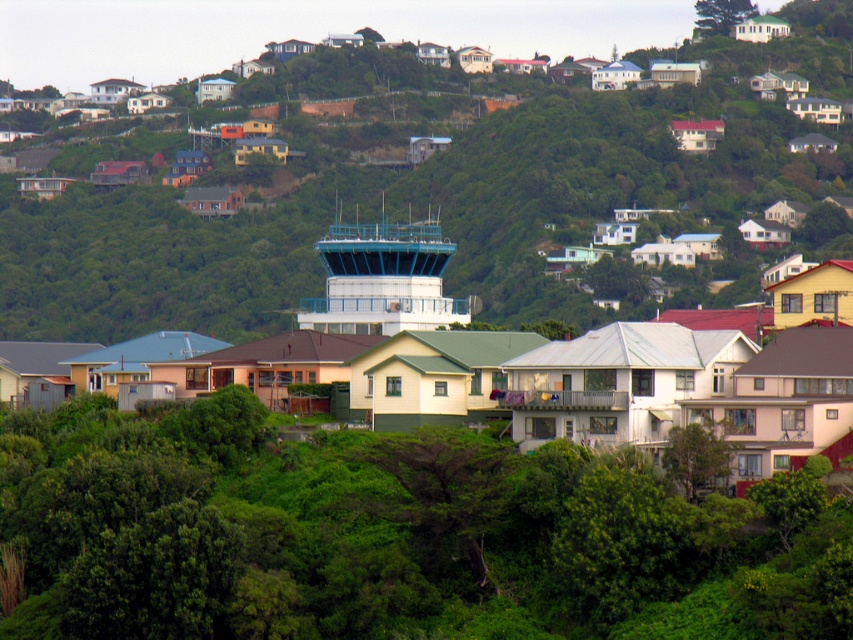
Who is shorter, white smooth control tower at center or green leafy tree at upper center?

green leafy tree at upper center is shorter.

In the scene shown: Who is lower down, white smooth control tower at center or green leafy tree at upper center?

white smooth control tower at center is lower down.

Locate an element on the screen. white smooth control tower at center is located at coordinates (381, 280).

Is point (683, 522) closer to camera compared to point (434, 221)?

Yes, point (683, 522) is in front of point (434, 221).

At what (x,y) coordinates should I click in order to perform the action: click on green leafy tree at center. Please return your answer as a coordinate pair (x, y). The height and width of the screenshot is (640, 853). Looking at the image, I should click on (387, 536).

Does green leafy tree at center have a smaller size compared to green leafy tree at upper center?

No, green leafy tree at center is not smaller than green leafy tree at upper center.

Can you confirm if green leafy tree at center is bigger than green leafy tree at upper center?

Indeed, green leafy tree at center has a larger size compared to green leafy tree at upper center.

The height and width of the screenshot is (640, 853). I want to click on green leafy tree at center, so click(x=387, y=536).

This screenshot has height=640, width=853. I want to click on green leafy tree at center, so click(387, 536).